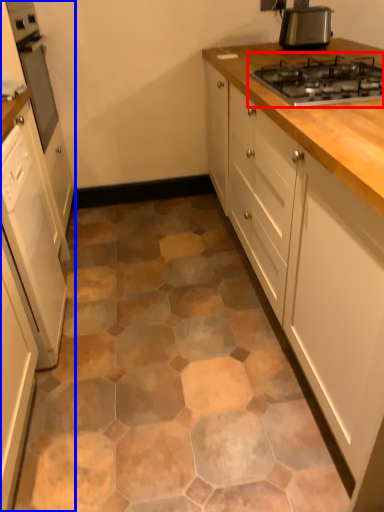
Question: Which of the following is the farthest to the observer, gas stove (highlighted by a red box) or cabinetry (highlighted by a blue box)?

Choices:
 (A) gas stove
 (B) cabinetry

Answer: (A)